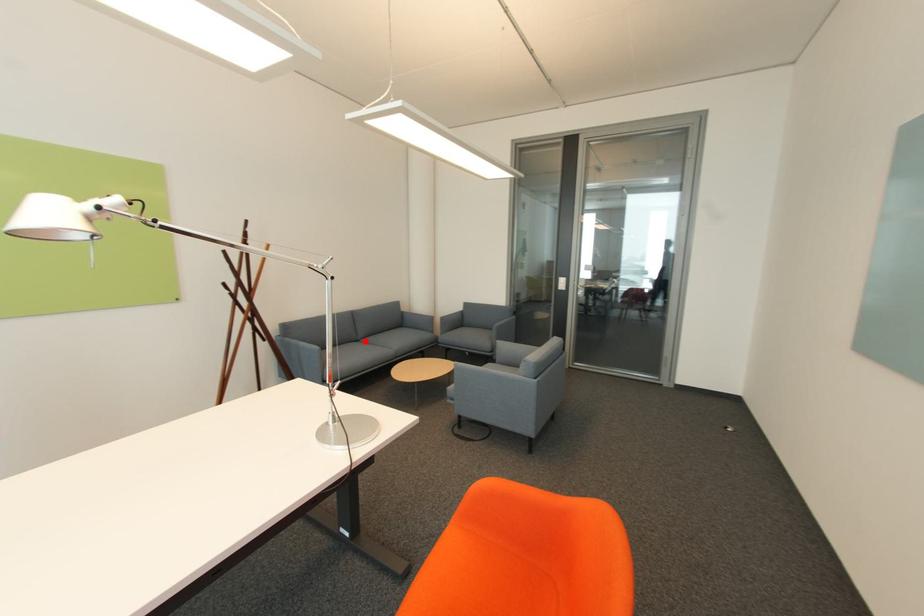
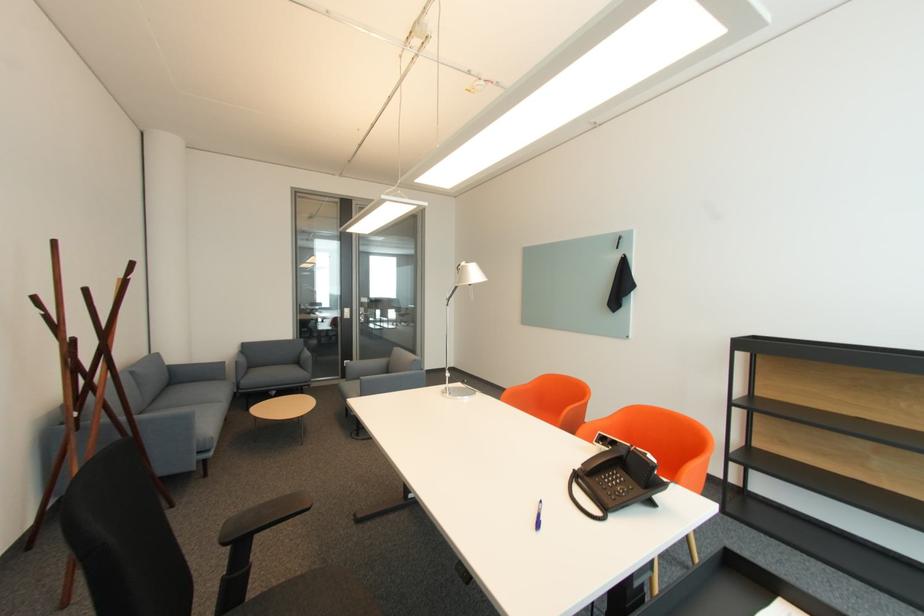
The point at the highlighted location is marked in the first image. Where is the corresponding point in the second image?

(151, 411)